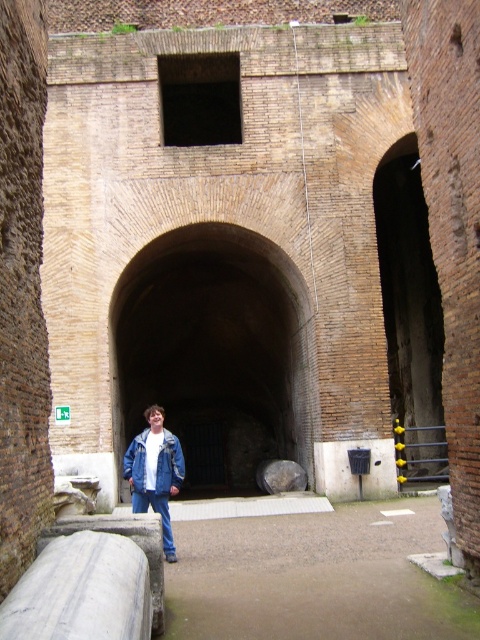
You are standing at the entrance of the ancient structure and want to reach the point marked as point (163, 429). There is an obstacle at point (384, 188). Which point is closer to you, the obstacle or the destination?

The obstacle at point (384, 188) is closer to you because it is further to the viewer than the destination point (163, 429), meaning the obstacle is nearer in the scene.

You are a photographer standing in front of the ancient structure. You notice the brick wall at right and the blue denim jacket at center. Which object is located to the right of the other?

The brick wall at right is positioned on the right side of blue denim jacket at center.